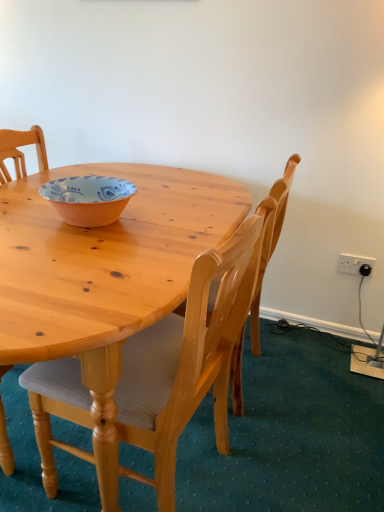
Identify the location of vacant space underneath light wood chair at center, the 2th chair from the back (from a real-world perspective). The width and height of the screenshot is (384, 512). (176, 478).